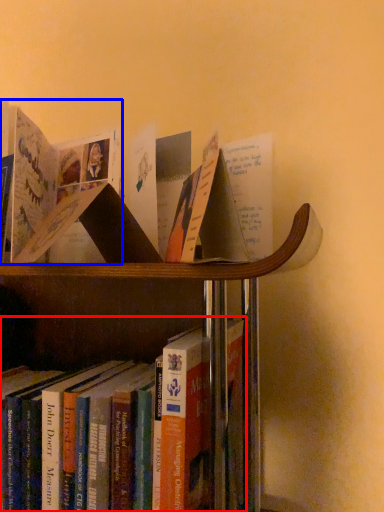
Question: Which object appears closest to the camera in this image, book (highlighted by a red box) or book (highlighted by a blue box)?

Choices:
 (A) book
 (B) book

Answer: (A)